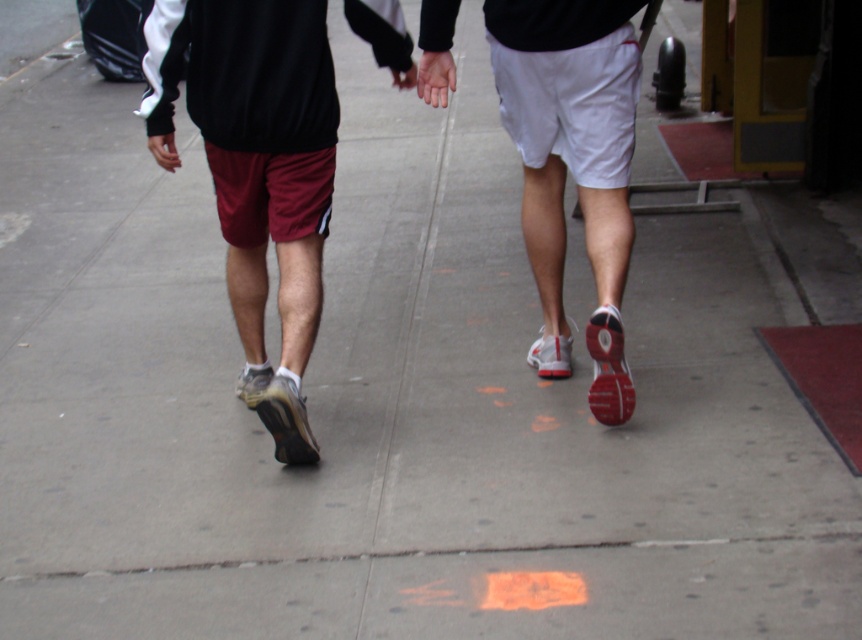
Between matte black shorts at center and white matte shorts at center, which one is positioned higher?

matte black shorts at center is higher up.

Is matte black shorts at center thinner than white matte shorts at center?

In fact, matte black shorts at center might be wider than white matte shorts at center.

Which is behind, point (547, 316) or point (579, 108)?

The point (547, 316) is more distant.

This screenshot has width=862, height=640. In order to click on matte black shorts at center in this screenshot , I will do `click(572, 163)`.

Is matte black shorts at center positioned in front of smooth skin hand at center?

That is True.

Who is positioned more to the right, matte black shorts at center or smooth skin hand at center?

From the viewer's perspective, smooth skin hand at center appears more on the right side.

Is point (155, 141) in front of point (435, 74)?

No, (155, 141) is further to viewer.

At what (x,y) coordinates should I click in order to perform the action: click on matte black shorts at center. Please return your answer as a coordinate pair (x, y). This screenshot has height=640, width=862. Looking at the image, I should click on (572, 163).

Which is above, white matte shorts at center or smooth skin hand at center?

smooth skin hand at center is above.

Which is behind, point (523, 186) or point (445, 54)?

The point (523, 186) is more distant.

The width and height of the screenshot is (862, 640). What do you see at coordinates (573, 163) in the screenshot? I see `white matte shorts at center` at bounding box center [573, 163].

Where is `white matte shorts at center`? The image size is (862, 640). white matte shorts at center is located at coordinates (573, 163).